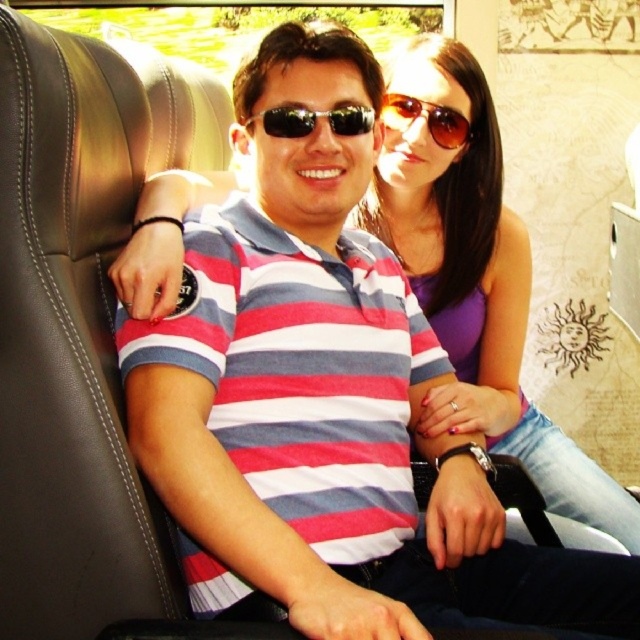
Question: Is black reflective sunglasses at center above sunglasses at upper center?

Choices:
 (A) yes
 (B) no

Answer: (B)

Question: Can you confirm if black reflective sunglasses at center is positioned to the right of sunglasses at upper center?

Choices:
 (A) yes
 (B) no

Answer: (B)

Question: Which point is farther to the camera?

Choices:
 (A) sunglasses at upper center
 (B) black reflective sunglasses at center

Answer: (A)

Question: Is black reflective sunglasses at center further to camera compared to sunglasses at upper center?

Choices:
 (A) yes
 (B) no

Answer: (B)